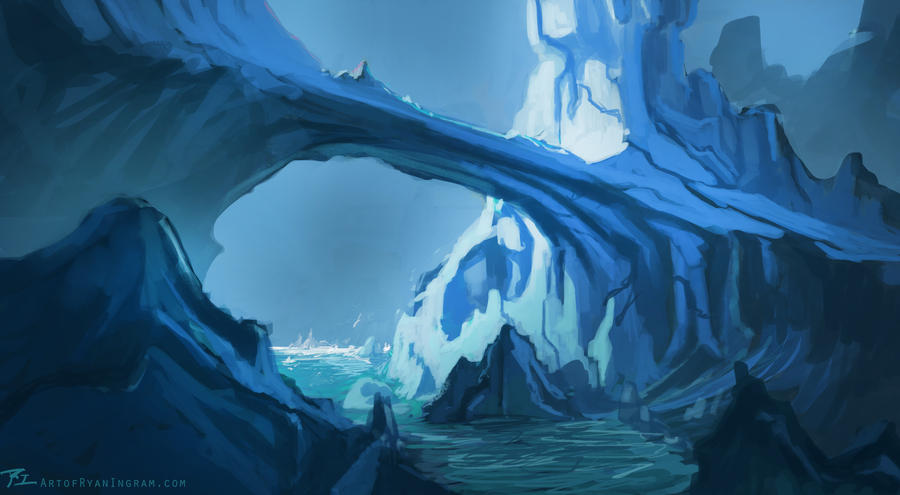
Find the location of a particular element. artwork is located at coordinates (473, 288).